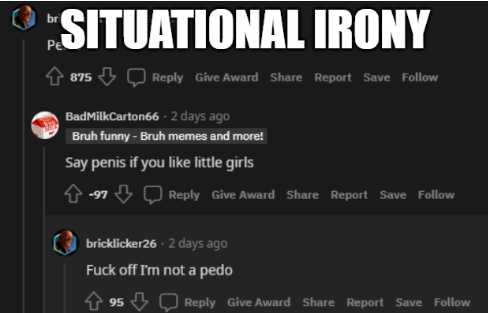
You are a GUI agent. You are given a task and a screenshot of the screen. Output one action in this format:
    pyautogui.click(x=<x>, y=<y>)
    Task: Click on the primary poster
    Image resolution: width=488 pixels, height=313 pixels.
    Given the screenshot: What is the action you would take?
    pyautogui.click(x=32, y=21), pyautogui.click(x=69, y=239)